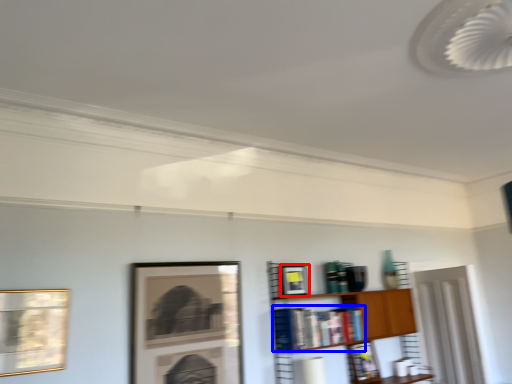
Question: Which of the following is the closest to the observer, picture frame (highlighted by a red box) or book (highlighted by a blue box)?

Choices:
 (A) picture frame
 (B) book

Answer: (B)